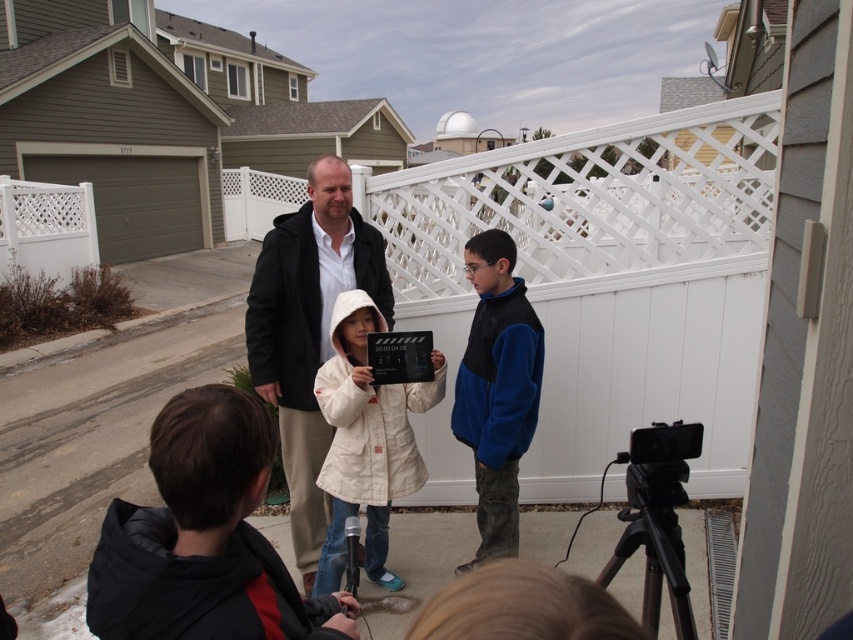
Based on the photo, which of these two, white quilted coat at center or black matte plaque at center, stands shorter?

With less height is black matte plaque at center.

Is point (352, 385) positioned after point (405, 332)?

No.

Is point (332, 406) farther from viewer compared to point (398, 348)?

That is False.

I want to click on white quilted coat at center, so click(366, 440).

Does blue fleece vest at center have a greater height compared to black plastic tripod at lower right?

Indeed, blue fleece vest at center has a greater height compared to black plastic tripod at lower right.

Between point (503, 492) and point (642, 509), which one is positioned in front?

Point (642, 509) is more forward.

Where is `blue fleece vest at center`? Image resolution: width=853 pixels, height=640 pixels. blue fleece vest at center is located at coordinates (497, 388).

What do you see at coordinates (308, 332) in the screenshot?
I see `dark gray jacket at center` at bounding box center [308, 332].

Does point (305, 467) come in front of point (347, 392)?

No, (305, 467) is behind (347, 392).

The height and width of the screenshot is (640, 853). I want to click on dark gray jacket at center, so click(x=308, y=332).